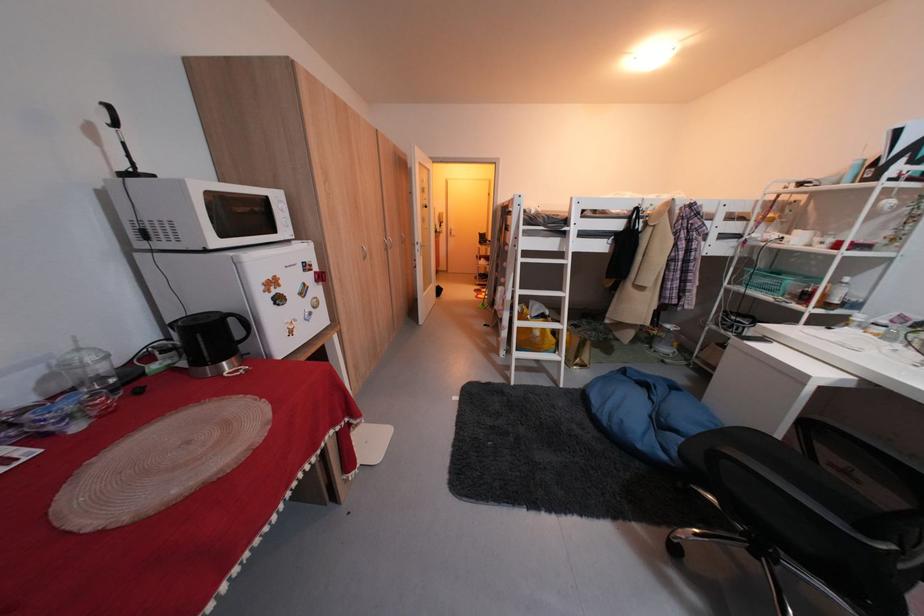
Identify the location of silver door handle. (363, 252).